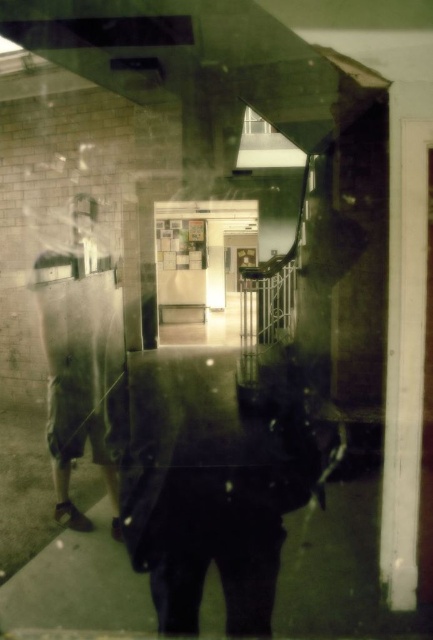
Question: Which point is closer to the camera taking this photo?

Choices:
 (A) (262, 522)
 (B) (99, 339)

Answer: (A)

Question: Which object appears closest to the camera in this image?

Choices:
 (A) matte khaki shorts at left
 (B) dark fabric jacket at center

Answer: (B)

Question: Is dark fabric jacket at center bigger than matte khaki shorts at left?

Choices:
 (A) no
 (B) yes

Answer: (A)

Question: Does dark fabric jacket at center appear on the right side of matte khaki shorts at left?

Choices:
 (A) yes
 (B) no

Answer: (A)

Question: Is dark fabric jacket at center bigger than matte khaki shorts at left?

Choices:
 (A) yes
 (B) no

Answer: (B)